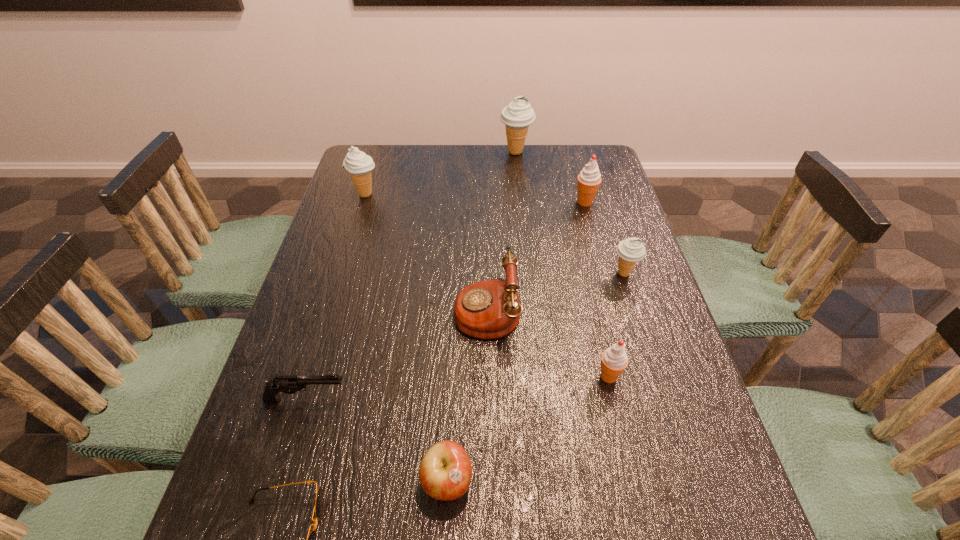
In order to click on vacant area at the far right corner in this screenshot , I will do `click(612, 176)`.

Identify the location of vacant space that is in between the apple and the nearest icecream. This screenshot has width=960, height=540. (528, 428).

Where is `free point between the farthest object and the nearest icecream`? This screenshot has height=540, width=960. free point between the farthest object and the nearest icecream is located at coordinates (563, 264).

Image resolution: width=960 pixels, height=540 pixels. I want to click on empty space that is in between the telephone and the apple, so click(x=467, y=394).

Select which object appears as the closest to the leftmost beige icecream. Please provide its 2D coordinates. Your answer should be formatted as a tuple, i.e. [(x, y)], where the tuple contains the x and y coordinates of a point satisfying the conditions above.

[(489, 309)]

Identify the location of the fourth closest object to the telephone. (630, 251).

Select which icecream appears as the fourth closest to the leftmost beige icecream. Please provide its 2D coordinates. Your answer should be formatted as a tuple, i.e. [(x, y)], where the tuple contains the x and y coordinates of a point satisfying the conditions above.

[(614, 360)]

The height and width of the screenshot is (540, 960). What are the coordinates of `the second closest icecream to the black sunglasses` in the screenshot? It's located at (630, 251).

The width and height of the screenshot is (960, 540). What are the coordinates of `beige icecream that stands as the closest to the sixth farthest object` in the screenshot? It's located at (630, 251).

Locate which beige icecream ranks third in proximity to the apple. Please provide its 2D coordinates. Your answer should be formatted as a tuple, i.e. [(x, y)], where the tuple contains the x and y coordinates of a point satisfying the conditions above.

[(518, 115)]